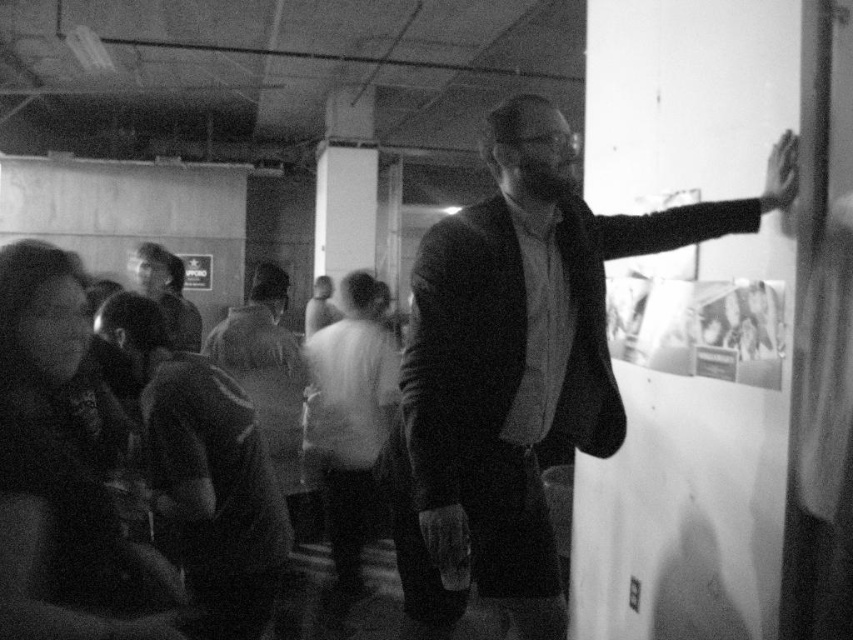
Between matte black suit at center and smooth beige shirt at center, which one has more height?

smooth beige shirt at center

Is matte black suit at center bigger than smooth beige shirt at center?

Yes.

Between point (526, 284) and point (263, 268), which one is positioned behind?

Point (263, 268)

Where is `matte black suit at center`? matte black suit at center is located at coordinates (514, 365).

Is dark fabric jacket at lower left wider than smooth skin hand at upper right?

Indeed, dark fabric jacket at lower left has a greater width compared to smooth skin hand at upper right.

Is dark fabric jacket at lower left taller than smooth skin hand at upper right?

Yes, dark fabric jacket at lower left is taller than smooth skin hand at upper right.

What do you see at coordinates (206, 472) in the screenshot?
I see `dark fabric jacket at lower left` at bounding box center [206, 472].

Identify the location of dark fabric jacket at lower left. This screenshot has height=640, width=853. (206, 472).

Which is above, smooth beige shirt at center or smooth fabric shirt at center?

smooth fabric shirt at center is higher up.

Who is shorter, smooth beige shirt at center or smooth fabric shirt at center?

smooth fabric shirt at center

Who is more distant from viewer, (x=256, y=285) or (x=160, y=262)?

The point (x=160, y=262) is more distant.

Find the location of a particular element. The height and width of the screenshot is (640, 853). smooth beige shirt at center is located at coordinates (270, 381).